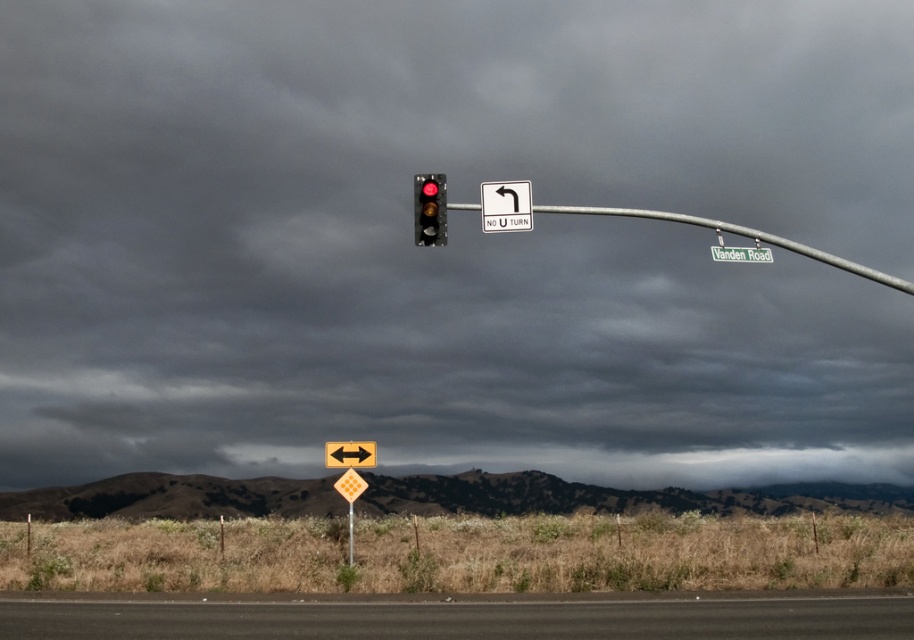
Question: Based on their relative distances, which object is nearer to the green plastic street sign at upper center?

Choices:
 (A) metallic yellow sign at lower center
 (B) yellow diamond at center
 (C) matte black traffic light at upper center
 (D) white plastic sign at upper center

Answer: (D)

Question: Can you confirm if white plastic sign at upper center is smaller than green plastic street sign at upper center?

Choices:
 (A) yes
 (B) no

Answer: (A)

Question: Which point is farther to the camera?

Choices:
 (A) metallic yellow sign at lower center
 (B) yellow diamond at center

Answer: (A)

Question: Which point is closer to the camera?

Choices:
 (A) (747, 257)
 (B) (422, 179)
 (C) (348, 552)

Answer: (B)

Question: Does yellow diamond at center appear on the right side of green plastic street sign at upper center?

Choices:
 (A) yes
 (B) no

Answer: (B)

Question: Does black asphalt road at lower center lie in front of yellow diamond at center?

Choices:
 (A) yes
 (B) no

Answer: (A)